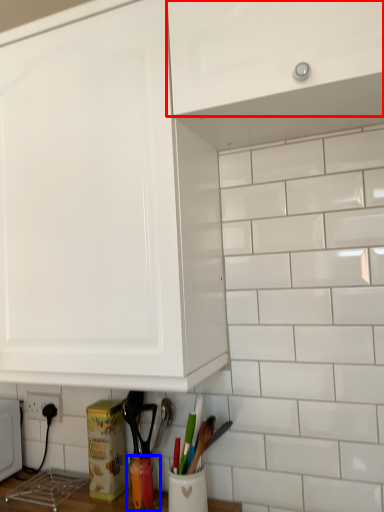
Question: Which of the following is the closest to the observer, cabinetry (highlighted by a red box) or appliance (highlighted by a blue box)?

Choices:
 (A) cabinetry
 (B) appliance

Answer: (A)